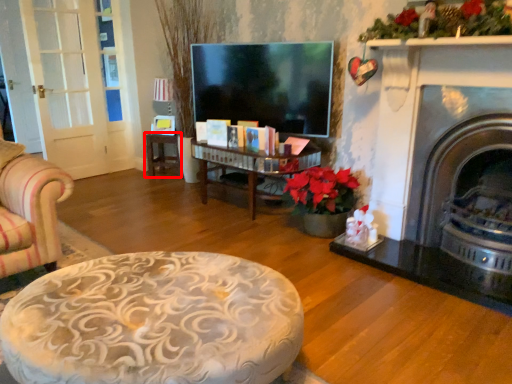
Question: From the image's perspective, what is the correct spatial relationship of table (annotated by the red box) in relation to fireplace?

Choices:
 (A) above
 (B) below

Answer: (A)